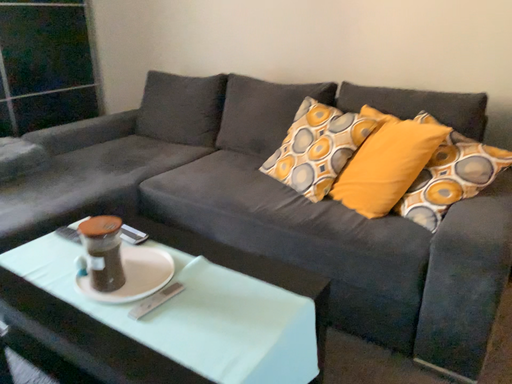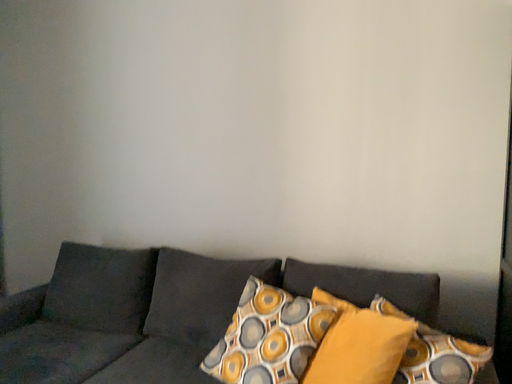
Question: How did the camera likely rotate when shooting the video?

Choices:
 (A) rotated right
 (B) rotated left

Answer: (A)